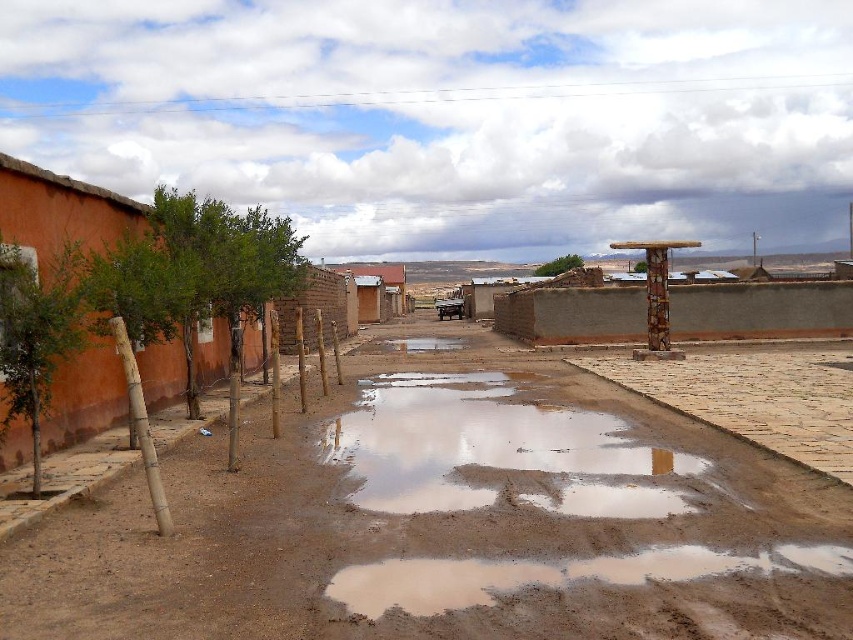
You are standing at the point marked by point [447,522] in the image. What material are you standing on?

You are standing on brown dirt at center.

You are a hiker trying to cross the road shown in the image. You have two options to walk on either the brown dirt at center or the transparent mud water at center. Which surface is more to the left for you to step on?

The brown dirt at center is to the left of transparent mud water at center, so you should step on the brown dirt at center if you want the surface more to the left.